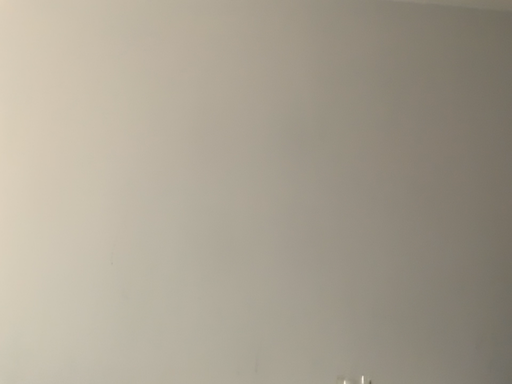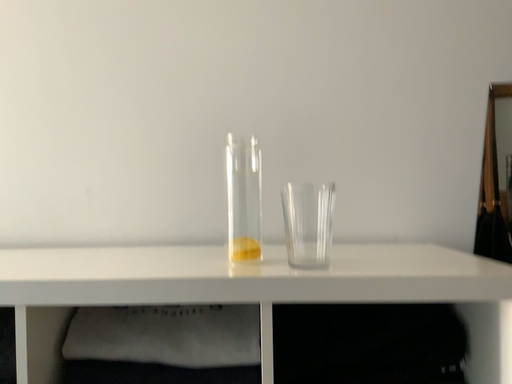
Question: Which way did the camera rotate in the video?

Choices:
 (A) rotated right
 (B) rotated left

Answer: (B)